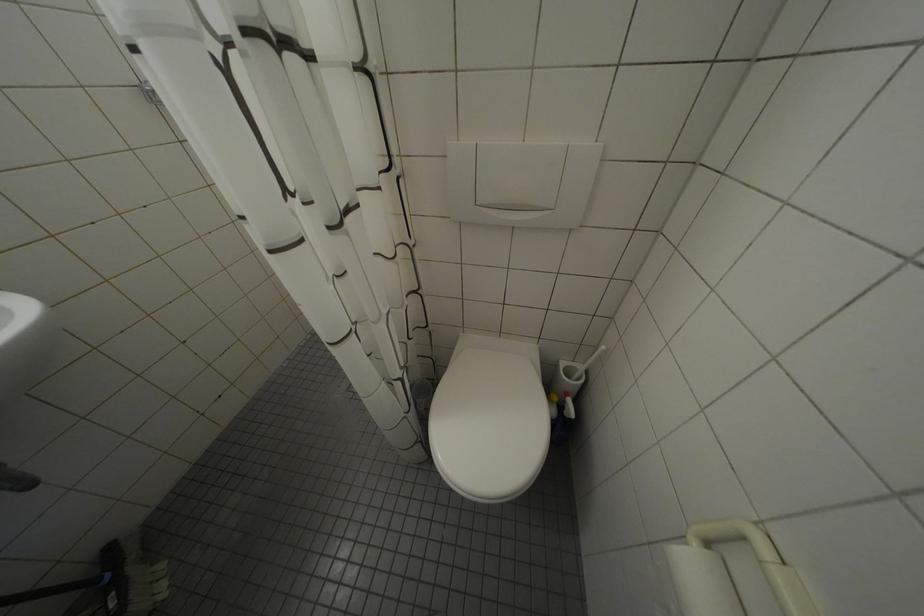
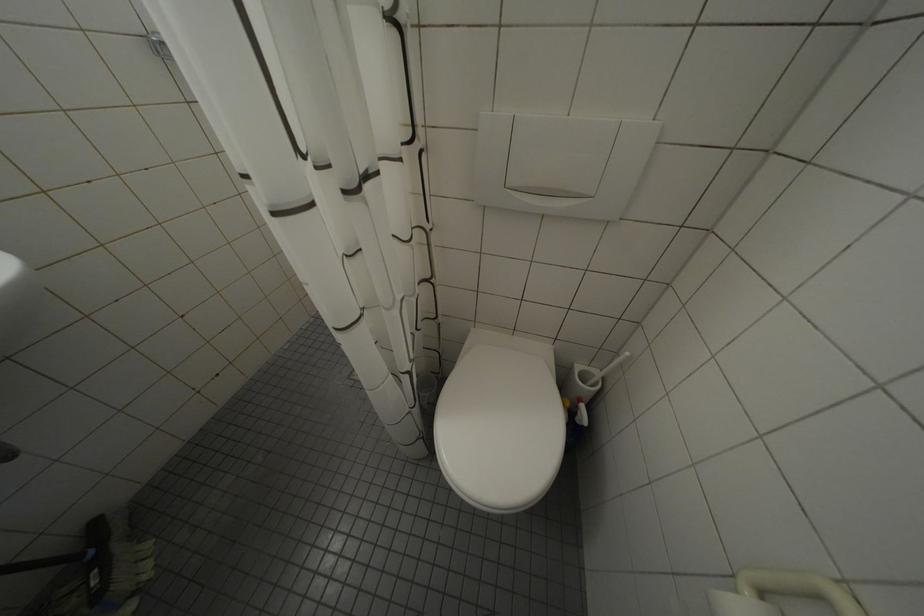
In a continuous first-person perspective shot, in which direction is the camera moving?

The movement direction of the cameraman is left, forward.